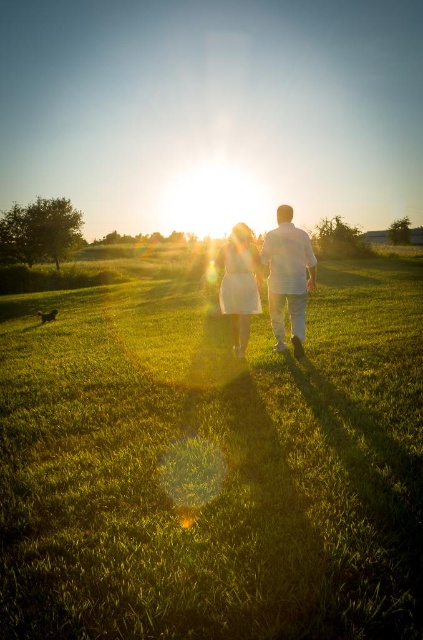
Looking at this image, you are standing at the point with coordinates [213,464] in the image. What object is located at this point?

The green grassy field at center is located at point [213,464].

You are standing at the origin point of the coordinate system. You want to walk towards the green grassy field at center. Which direction should you move in?

The green grassy field at center is located at coordinate point (213, 464). Since you are at the origin, you should move towards the positive x and y directions to reach it.